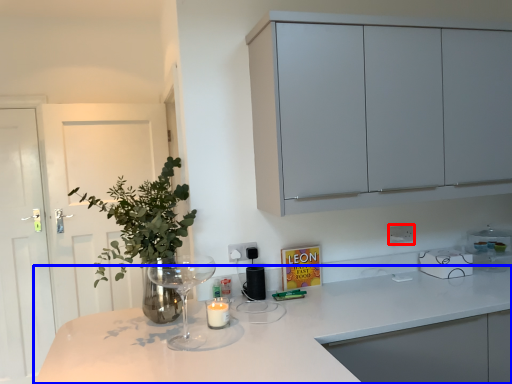
Question: Which point is closer to the camera, electric outlet (highlighted by a red box) or countertop (highlighted by a blue box)?

Choices:
 (A) electric outlet
 (B) countertop

Answer: (B)